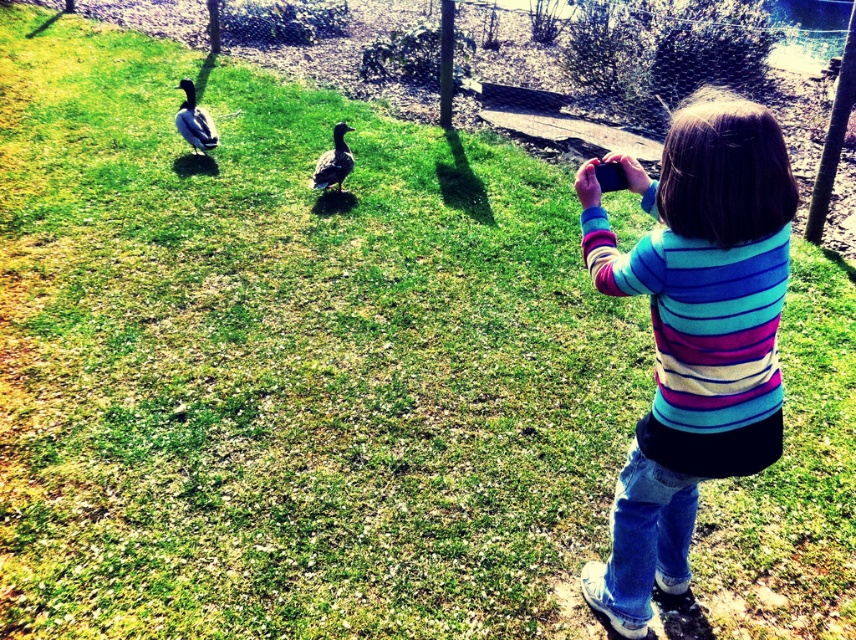
You are the child in the scene holding the smartphone. You want to take a photo of both the brown feathered duck at left and the brown matte duck at center. Can you fit both ducks in your photo if your smartphone camera has a maximum capture width of 1.5 meters?

The brown feathered duck at left and brown matte duck at center are 1.42 meters apart from each other. Since the distance between them is less than the smartphone camera maximum capture width of 1.5 meters, both ducks can be captured in the photo.

You are a photographer trying to frame the brown feathered duck at left in your shot. What are the coordinates of the duck to ensure proper framing?

The coordinates of the brown feathered duck at left are at point (194, 122).